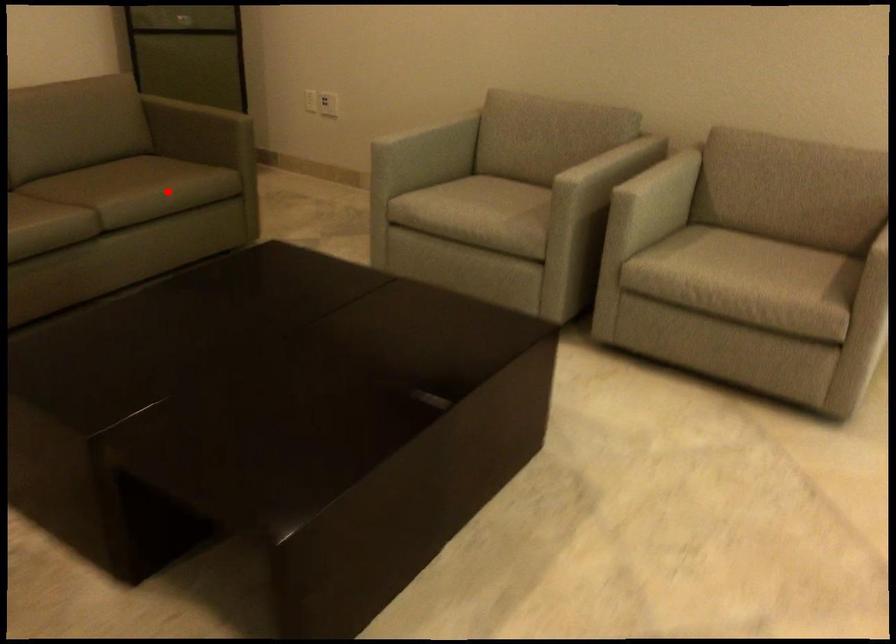
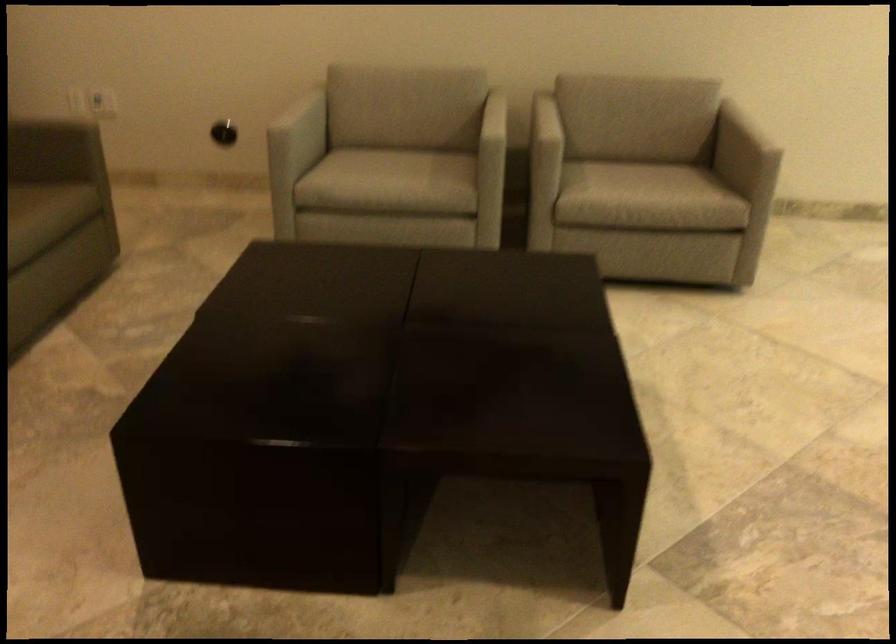
Find the pixel in the second image that matches the highlighted location in the first image.

(36, 219)